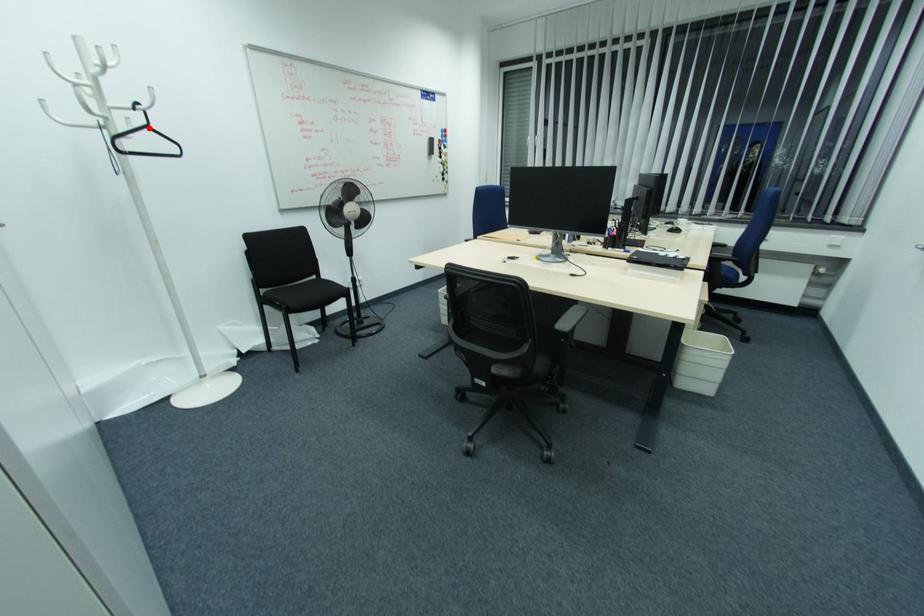
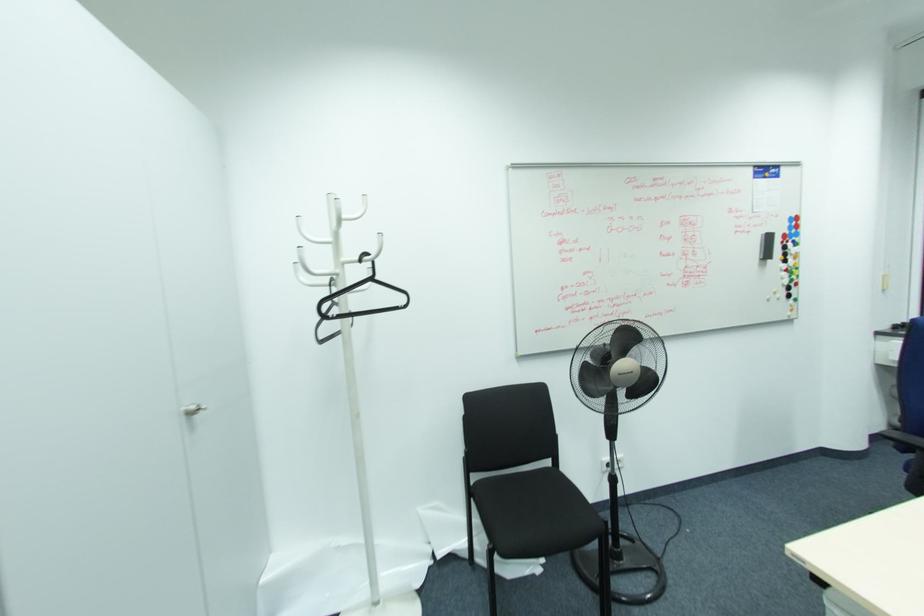
Locate, in the second image, the point that corresponds to the highlighted location in the first image.

(371, 280)